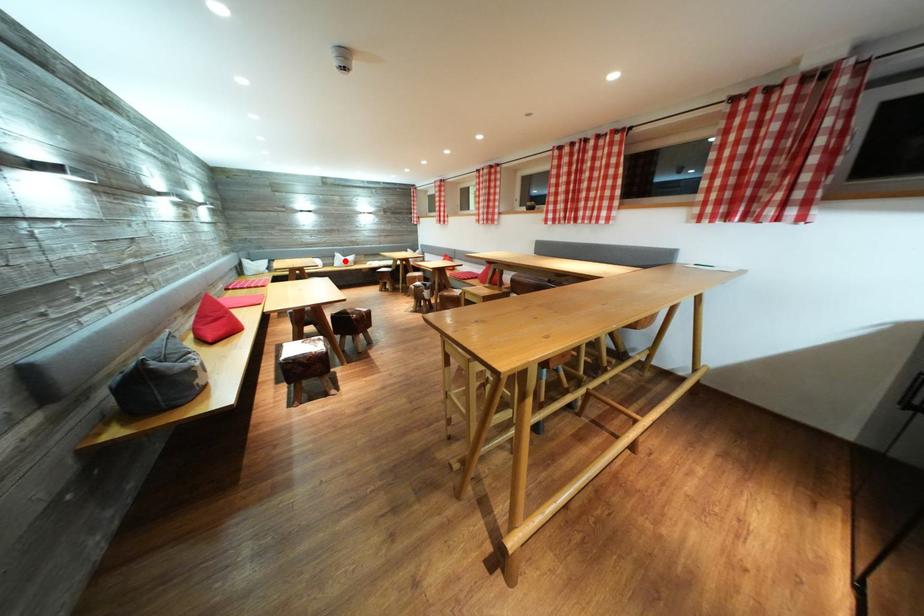
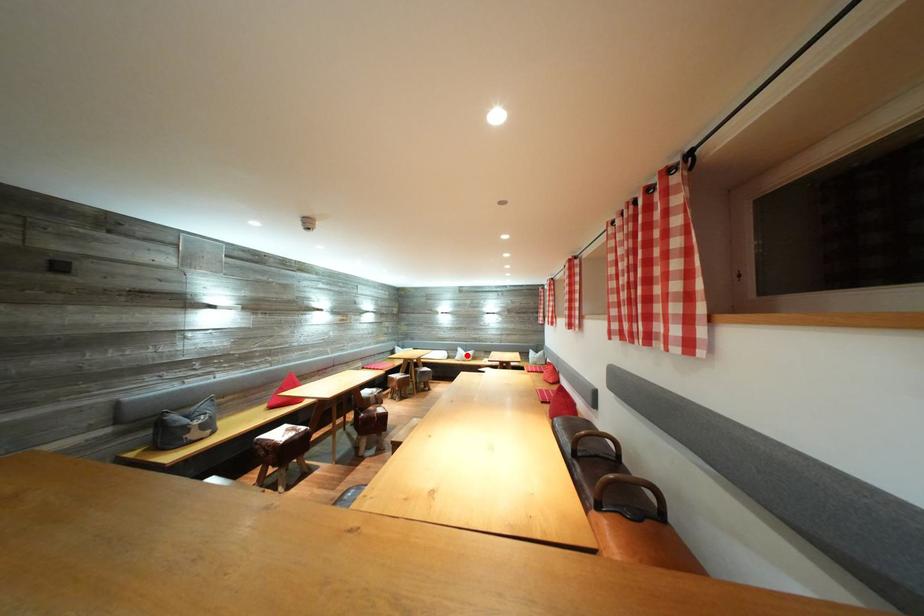
I am providing you with two images of the same scene from different viewpoints. A red point is marked on the first image and another point is marked on the second image. Is the marked point in image1 the same physical position as the marked point in image2?

Yes